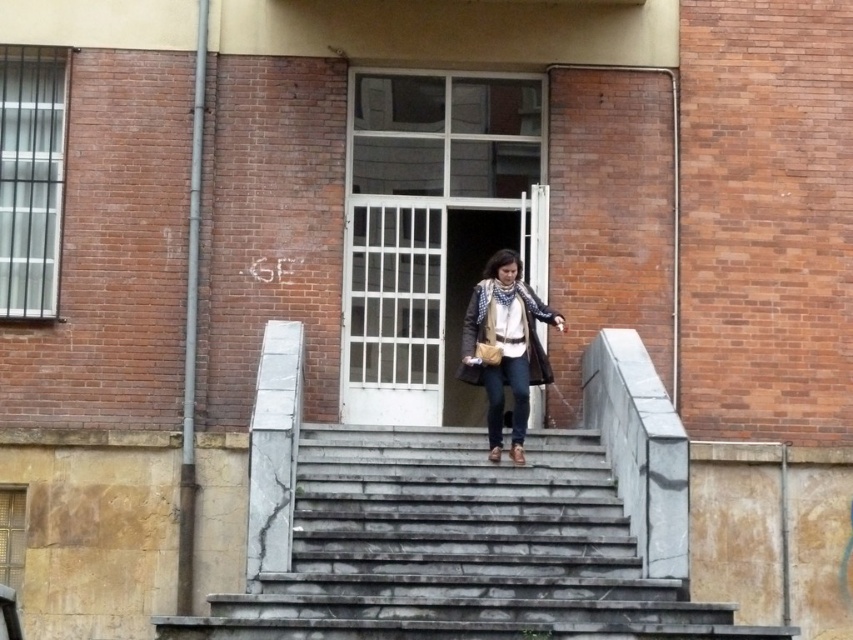
In the scene shown: You are standing at the top of the gray marble stairs at center and want to hand a package to the person wearing the brown leather jacket at center. Can you reach them without moving from your current position?

The gray marble stairs at center is below brown leather jacket at center, so you are lower than them. You can reach them by extending your arm upwards since they are above you.

You are standing in front of the building and see the gray marble stairs at center and the brown leather jacket at center. Which object is taller?

The brown leather jacket at center is taller than the gray marble stairs at center.

You are standing in front of the building and want to determine the distance between two points marked on the steps. The first point is at coordinate point (480, 538) and the second is at point (497, 326). Which point is closer to you?

Point (480, 538) is closer to the viewer than point (497, 326).